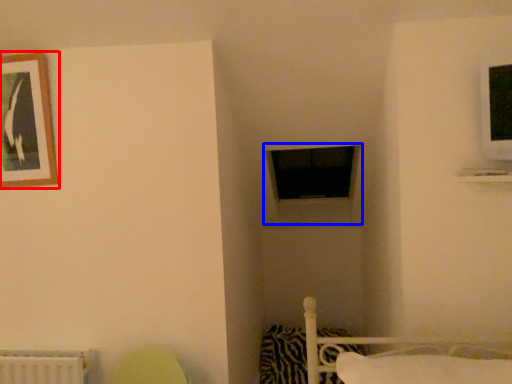
Question: Which point is closer to the camera, picture frame (highlighted by a red box) or window frame (highlighted by a blue box)?

Choices:
 (A) picture frame
 (B) window frame

Answer: (A)